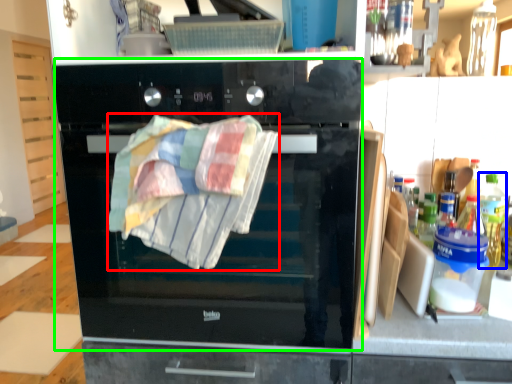
Question: Which object is the farthest from beach towel (highlighted by a red box)? Choose among these: bottle (highlighted by a blue box) or oven (highlighted by a green box).

Choices:
 (A) bottle
 (B) oven

Answer: (A)